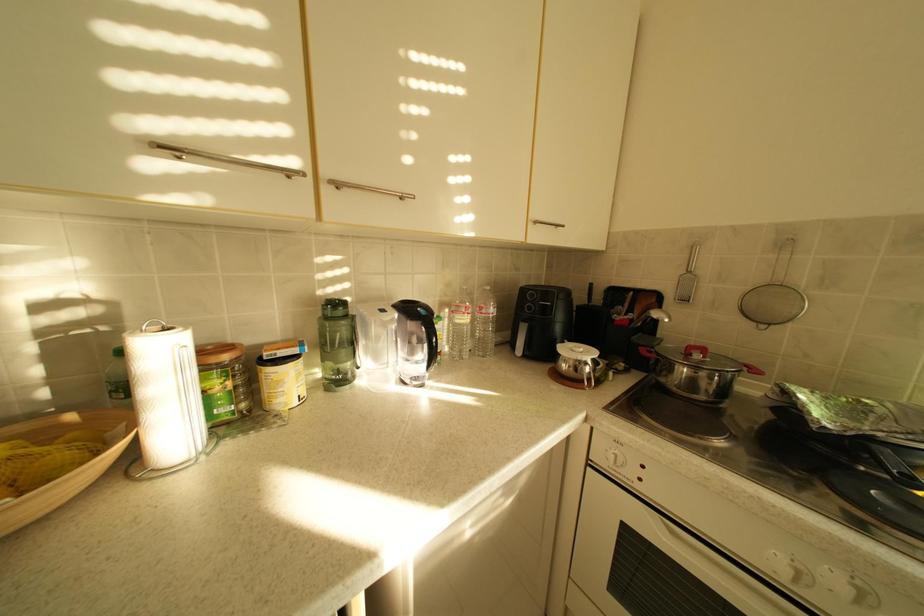
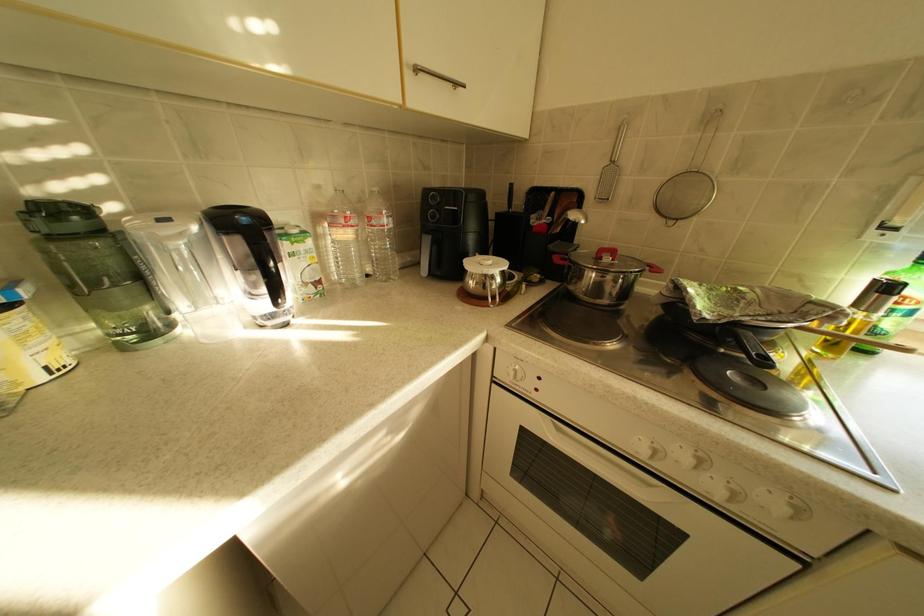
In a continuous first-person perspective shot, in which direction is the camera moving?

The cameraman walked toward right, forward.